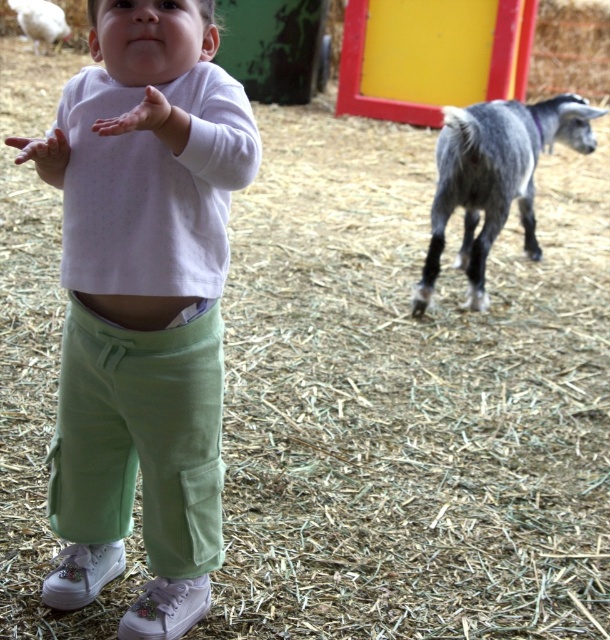
Question: Is light green cotton pants at center below white fluffy sheep at upper left?

Choices:
 (A) yes
 (B) no

Answer: (A)

Question: Which is nearer to the white fluffy sheep at upper left?

Choices:
 (A) gray woolen goat at right
 (B) light green cotton pants at center

Answer: (A)

Question: Does gray woolen goat at right have a larger size compared to white fluffy sheep at upper left?

Choices:
 (A) yes
 (B) no

Answer: (A)

Question: Which object appears closest to the camera in this image?

Choices:
 (A) white fluffy sheep at upper left
 (B) gray woolen goat at right

Answer: (B)

Question: Can you confirm if light green cotton pants at center is positioned above white fluffy sheep at upper left?

Choices:
 (A) yes
 (B) no

Answer: (B)

Question: Which of these objects is positioned closest to the gray woolen goat at right?

Choices:
 (A) light green cotton pants at center
 (B) white fluffy sheep at upper left

Answer: (A)